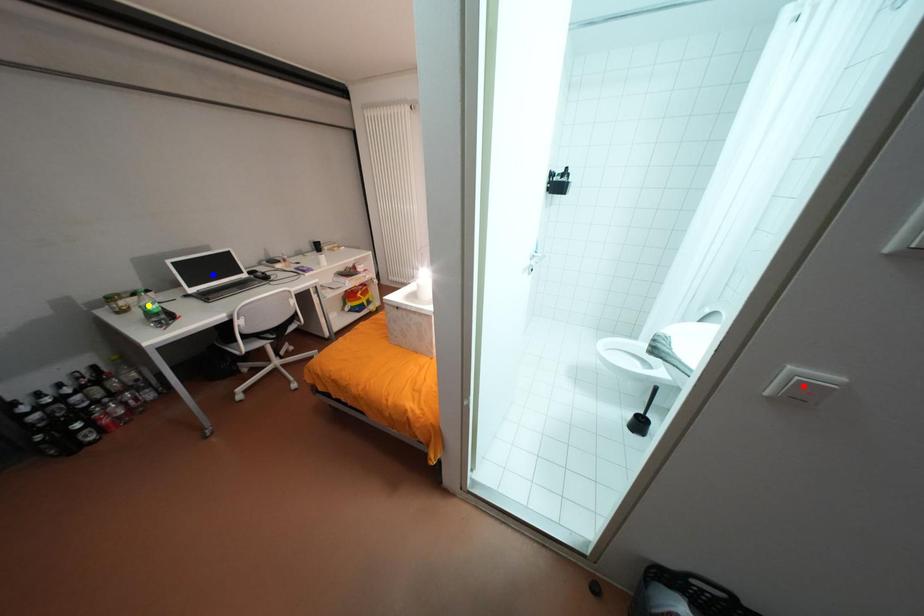
Order these from nearest to farthest:
1. red point
2. yellow point
3. blue point

blue point, yellow point, red point